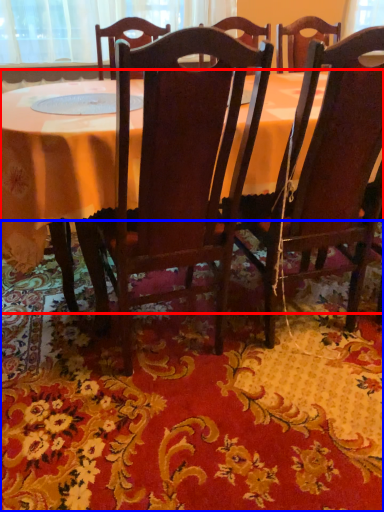
Question: Which of the following is the closest to the observer, table (highlighted by a red box) or mat (highlighted by a blue box)?

Choices:
 (A) table
 (B) mat

Answer: (B)